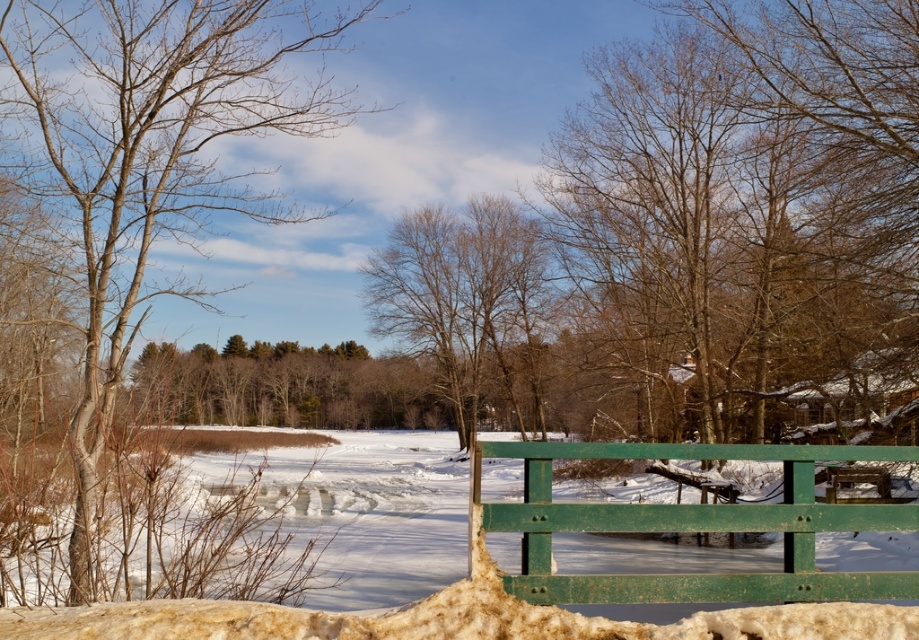
Which is behind, point (543, 448) or point (505, 273)?

Positioned behind is point (505, 273).

Which is in front, point (498, 509) or point (430, 321)?

Point (498, 509) is more forward.

The height and width of the screenshot is (640, 919). I want to click on green painted wood bench at center, so click(691, 525).

Between point (110, 134) and point (449, 636), which one is positioned in front?

Point (449, 636) is more forward.

Is point (53, 138) farther from camera compared to point (864, 529)?

Yes, point (53, 138) is farther from viewer.

You are a GUI agent. You are given a task and a screenshot of the screen. Output one action in this format:
    pyautogui.click(x=<x>, y=<y>)
    Task: Click on the brown bark tree at left
    
    Given the screenshot: What is the action you would take?
    pyautogui.click(x=154, y=157)

From the picture: Is white fluffy snow at center closer to camera compared to bare brown tree at center?

That is True.

Is point (557, 500) in front of point (421, 260)?

That is True.

Locate an element on the screen. This screenshot has width=919, height=640. white fluffy snow at center is located at coordinates (598, 573).